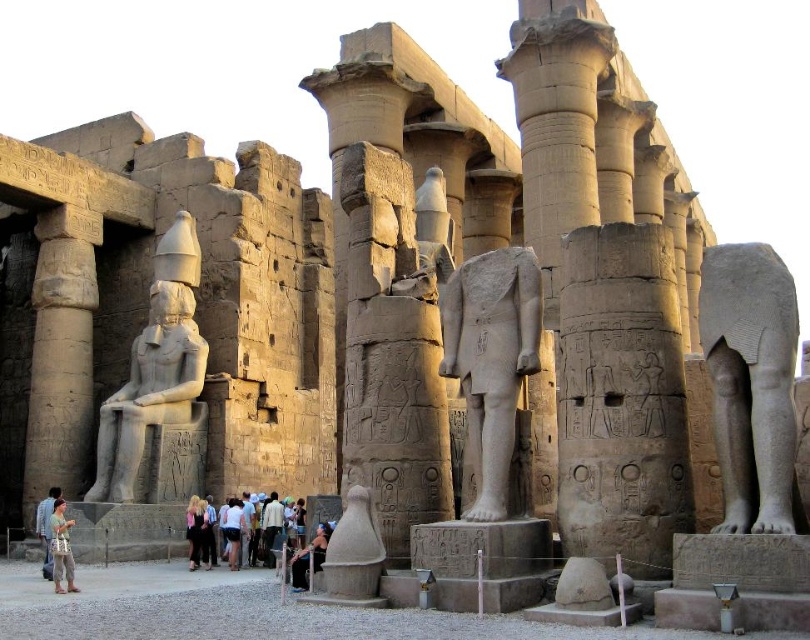
Question: Which of the following is the farthest from the observer?

Choices:
 (A) camouflage fabric backpack at lower left
 (B) light brown fabric dress at lower left
 (C) gray stone elephant at right

Answer: (B)

Question: Is gray stone statue at center thinner than camouflage fabric backpack at lower left?

Choices:
 (A) yes
 (B) no

Answer: (A)

Question: Is polished stone statue at center positioned before smooth stone vase at center?

Choices:
 (A) no
 (B) yes

Answer: (A)

Question: Which point is closer to the camera?

Choices:
 (A) (761, 394)
 (B) (548, 104)
 (C) (450, 349)
 (D) (301, 497)

Answer: (A)

Question: Does light brown fabric dress at lower left appear under white cotton shirt at center?

Choices:
 (A) yes
 (B) no

Answer: (A)

Question: Which point is farther to the camera?

Choices:
 (A) smooth stone vase at center
 (B) smooth stone column at center
 (C) light blue denim jeans at center
 (D) camouflage fabric backpack at lower left

Answer: (C)